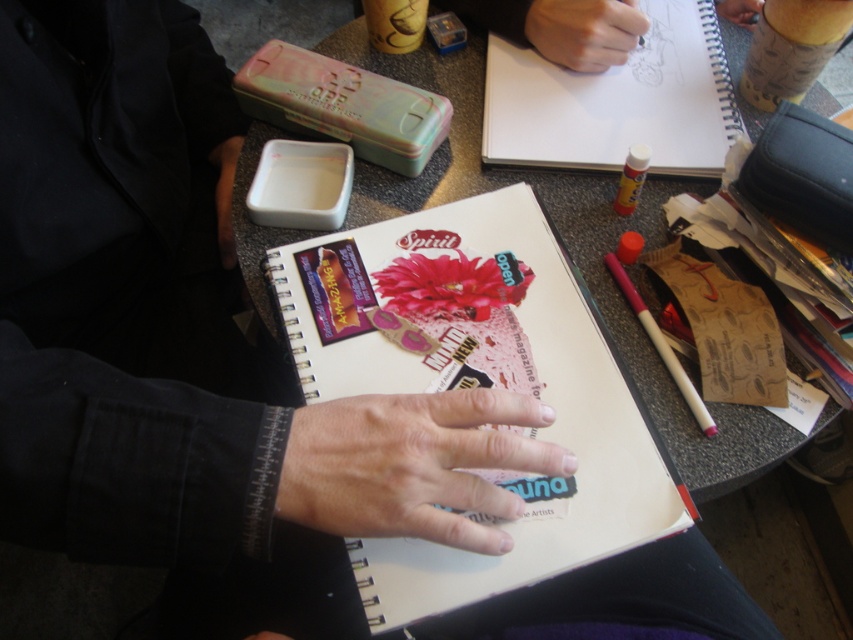
Question: Does white paper notebook at center lie in front of wooden pencil case at upper right?

Choices:
 (A) no
 (B) yes

Answer: (B)

Question: Among these points, which one is nearest to the camera?

Choices:
 (A) (639, 234)
 (B) (239, 96)

Answer: (A)

Question: Where is white plastic container at upper center located in relation to matte skin hand at upper center in the image?

Choices:
 (A) above
 (B) below

Answer: (B)

Question: Which point is farther to the camera?

Choices:
 (A) clear plastic glue stick at upper right
 (B) matte skin hand at upper center
 (C) spiral-bound paper at upper center
 (D) pastel plastic pencil case at upper center

Answer: (B)

Question: Among these points, which one is nearest to the camera?

Choices:
 (A) (433, 29)
 (B) (625, 234)

Answer: (B)

Question: Can you confirm if white paper notebook at center is bigger than wooden pencil case at upper right?

Choices:
 (A) no
 (B) yes

Answer: (B)